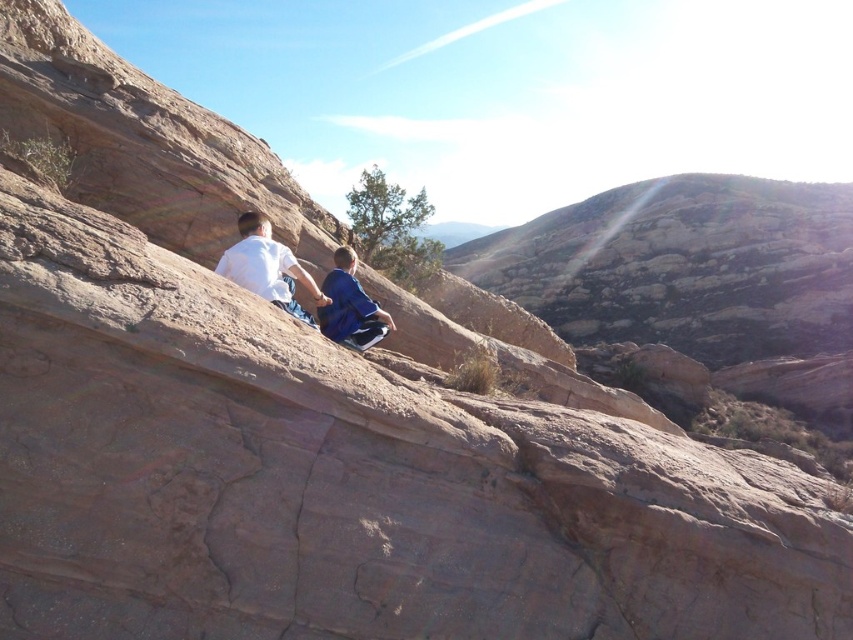
You are a photographer trying to capture a shot of the white matte shirt at center. You are standing at the origin point. Which direction should you move to get a better angle?

The white matte shirt at center is located at point (267,268), so you should move towards the coordinates to frame it better.

You are a photographer trying to capture a closeup of the white matte shirt at center and the blue fabric pants at center. Which object should you zoom in on if you want to focus on the wider one?

The white matte shirt at center might be wider than blue fabric pants at center, so you should zoom in on the white matte shirt at center to focus on the wider one.

You are standing at the base of the rock formation and want to reach the person at point (335,256). However, there is an obstacle at point (235,275). Can you walk directly to the person without going around the obstacle?

Point (235,275) is in front of point (335,256), so you cannot walk directly to the person at point (335,256) without going around the obstacle at point (235,275).